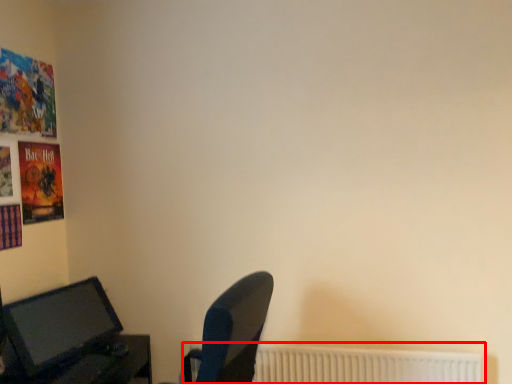
Question: From the image's perspective, considering the relative positions of radiator (annotated by the red box) and computer monitor in the image provided, where is radiator (annotated by the red box) located with respect to the staircase?

Choices:
 (A) below
 (B) above

Answer: (A)